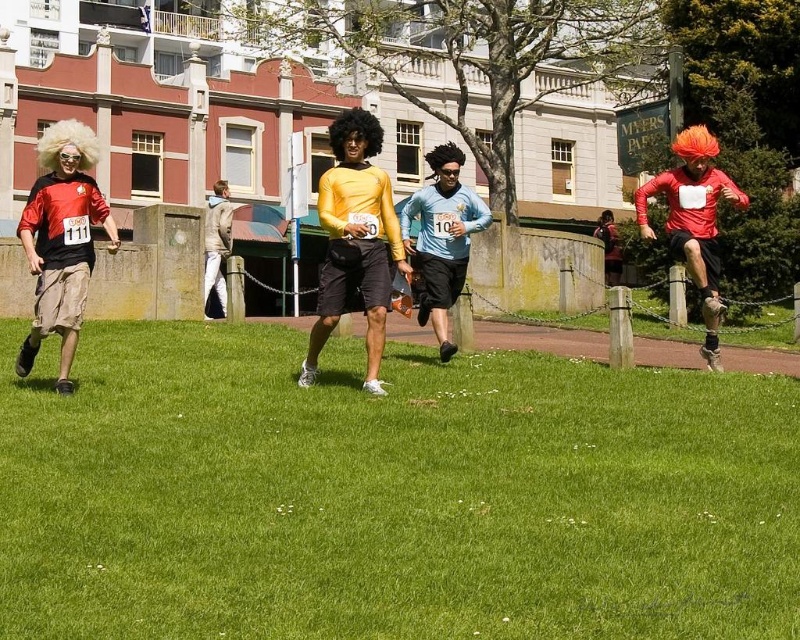
You are standing in the middle of the fun run path and want to move towards the two points marked in the image. Which point, point (254, 371) or point (336, 269), is closer to you?

Point (254, 371) is closer to you because it is further to the viewer than point (336, 269).

You are a photographer at the event and need to capture a photo of both the light blue jersey at center and the light beige jacket at center. Since you want to ensure both are clearly visible, which clothing item should you focus on first to avoid blurring due to their sizes?

The light blue jersey at center is narrower than the light beige jacket at center, so you should focus on the light beige jacket at center first to ensure it is in focus before the smaller one.